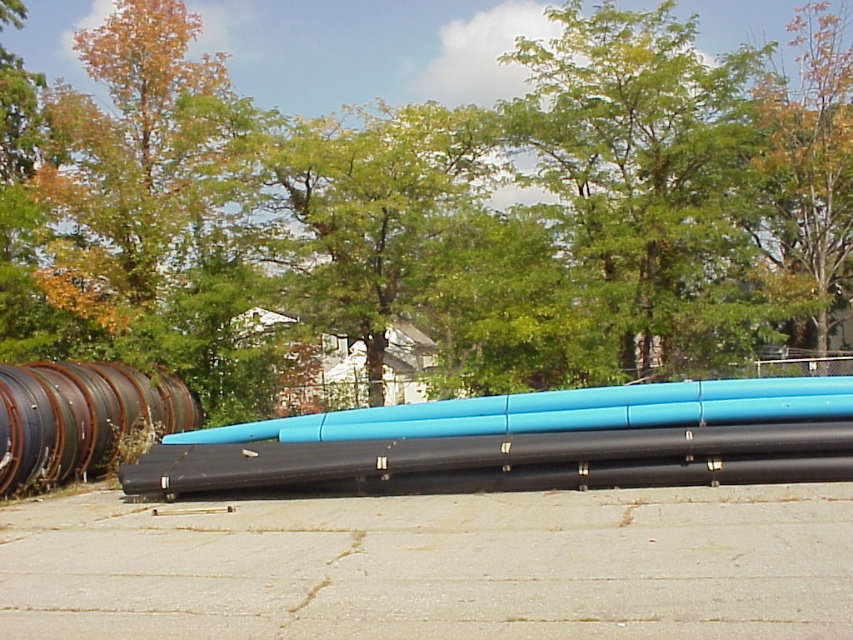
Question: Which object is the farthest from the green leafy tree at upper center?

Choices:
 (A) blue matte pipe at center
 (B) rusty metal barrel at left
 (C) gray concrete pavement at center
 (D) yellow-green foliage at upper right

Answer: (C)

Question: Which of the following is the farthest from the observer?

Choices:
 (A) (4, 118)
 (B) (810, 264)

Answer: (A)

Question: Estimate the real-world distances between objects in this image. Which object is farther from the blue matte pipe at center?

Choices:
 (A) green leafy tree at upper center
 (B) gray concrete pavement at center

Answer: (A)

Question: Does green leafy tree at upper center come behind gray concrete pavement at center?

Choices:
 (A) no
 (B) yes

Answer: (B)

Question: Does green leafy tree at upper center appear on the left side of rusty metal barrel at left?

Choices:
 (A) yes
 (B) no

Answer: (B)

Question: Does gray concrete pavement at center appear on the left side of blue matte pipe at center?

Choices:
 (A) no
 (B) yes

Answer: (B)